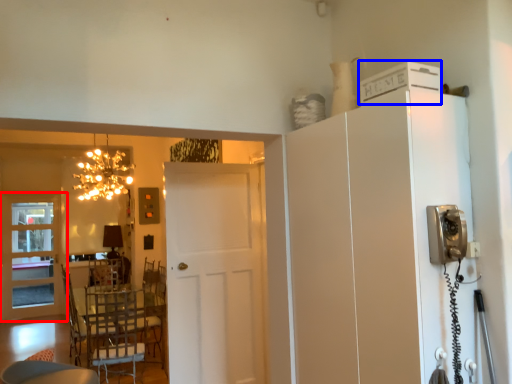
Question: Which object is further to the camera taking this photo, door (highlighted by a red box) or appliance (highlighted by a blue box)?

Choices:
 (A) door
 (B) appliance

Answer: (A)